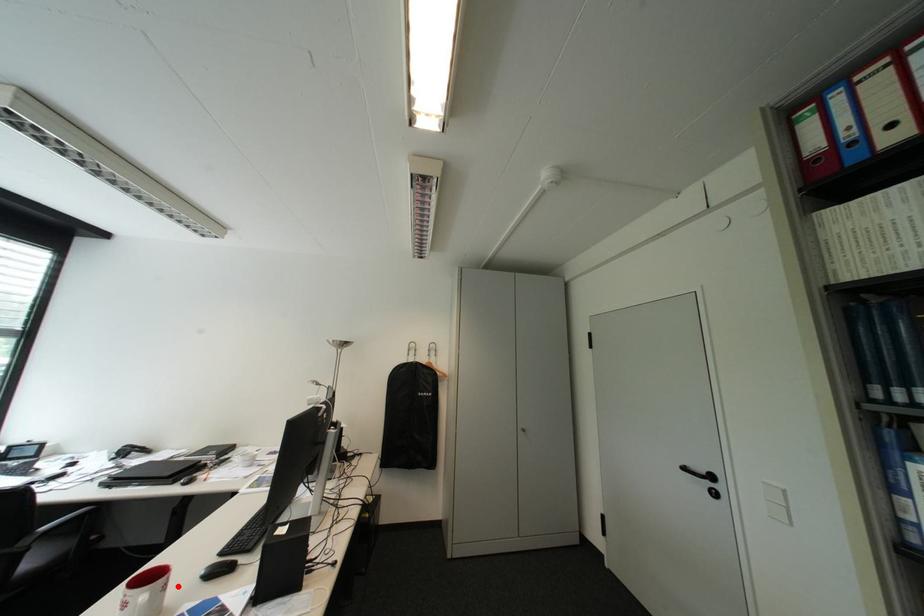
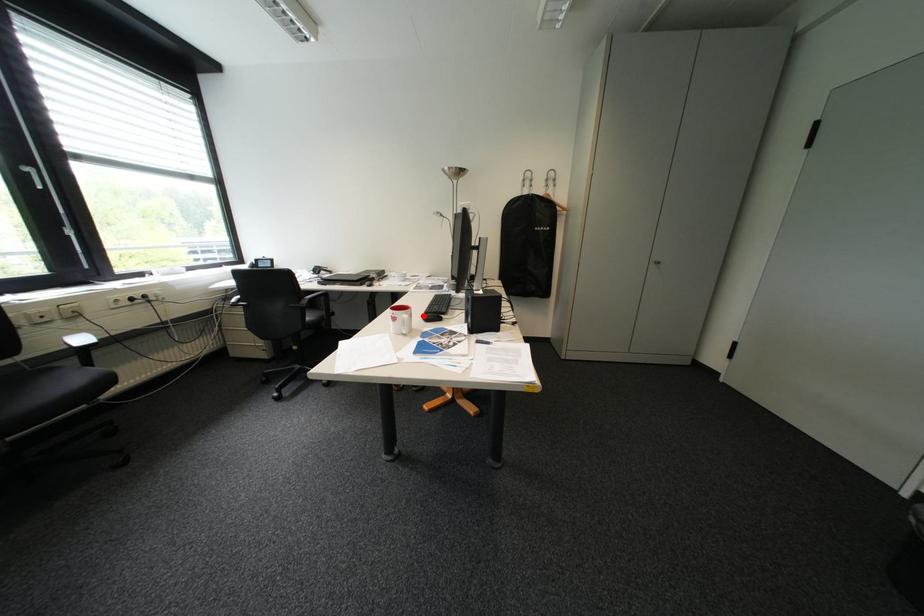
I am providing you with two images of the same scene from different viewpoints. A red point is marked on the first image and another point is marked on the second image. Do the highlighted points in image1 and image2 indicate the same real-world spot?

Yes